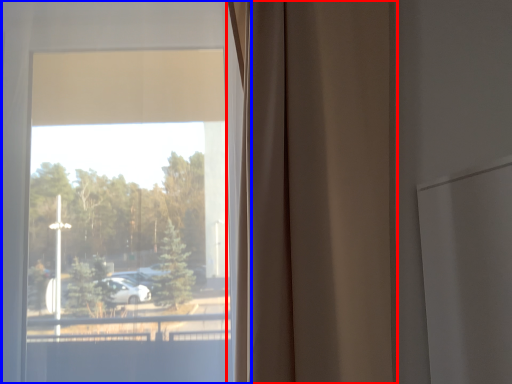
Question: Which of the following is the closest to the observer, curtain (highlighted by a red box) or window (highlighted by a blue box)?

Choices:
 (A) curtain
 (B) window

Answer: (A)